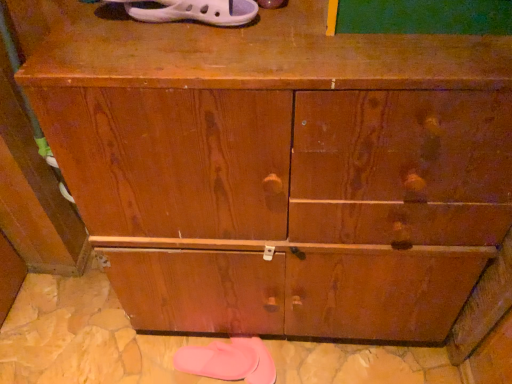
What is the approximate height of pink rubber slipper at lower center, acting as the 2th footwear starting from the front?

pink rubber slipper at lower center, acting as the 2th footwear starting from the front, is 3.07 inches in height.

At what (x,y) coordinates should I click in order to perform the action: click on pink rubber slipper at lower center, acting as the 2th footwear starting from the front. Please return your answer as a coordinate pair (x, y). Looking at the image, I should click on [229, 361].

From the picture: Measure the distance between point (x=208, y=364) and camera.

Point (x=208, y=364) and camera are 1.22 meters apart.

Describe the element at coordinates (229, 361) in the screenshot. I see `pink rubber slipper at lower center, acting as the 2th footwear starting from the front` at that location.

The height and width of the screenshot is (384, 512). What are the coordinates of `white rubber sandal at upper center, arranged as the 1th footwear when viewed from the top` in the screenshot? It's located at (197, 11).

Consider the image. In order to face white rubber sandal at upper center, the 2th footwear in the bottom-to-top sequence, should I rotate leftwards or rightwards?

To face it directly, rotate left by 8.524 degrees.

What do you see at coordinates (197, 11) in the screenshot? Image resolution: width=512 pixels, height=384 pixels. I see `white rubber sandal at upper center, the 2th footwear in the bottom-to-top sequence` at bounding box center [197, 11].

The image size is (512, 384). I want to click on pink rubber slipper at lower center, positioned as the 1th footwear in back-to-front order, so click(229, 361).

Which object is positioned more to the left, pink rubber slipper at lower center, acting as the 2th footwear starting from the front, or white rubber sandal at upper center, arranged as the 1th footwear when viewed from the top?

pink rubber slipper at lower center, acting as the 2th footwear starting from the front, is more to the left.

Is pink rubber slipper at lower center, which is counted as the second footwear, starting from the top, in front of or behind white rubber sandal at upper center, arranged as the 1th footwear when viewed from the top, in the image?

Visually, pink rubber slipper at lower center, which is counted as the second footwear, starting from the top, is located behind white rubber sandal at upper center, arranged as the 1th footwear when viewed from the top.

Between point (249, 352) and point (187, 0), which one is positioned in front?

The point (187, 0) is more forward.

From the image's perspective, which is below, pink rubber slipper at lower center, positioned as the 1th footwear in back-to-front order, or white rubber sandal at upper center, arranged as the 1th footwear when viewed from the top?

pink rubber slipper at lower center, positioned as the 1th footwear in back-to-front order, appears lower in the image.

From a real-world perspective, which object stands above the other?

In real-world perspective, white rubber sandal at upper center, placed as the second footwear when sorted from back to front, is above.

Which object is thinner, pink rubber slipper at lower center, the first footwear from the bottom, or white rubber sandal at upper center, placed as the second footwear when sorted from back to front?

pink rubber slipper at lower center, the first footwear from the bottom.

Which of these two, pink rubber slipper at lower center, acting as the 2th footwear starting from the front, or white rubber sandal at upper center, the 2th footwear in the bottom-to-top sequence, stands taller?

pink rubber slipper at lower center, acting as the 2th footwear starting from the front, is taller.

Which of these two, pink rubber slipper at lower center, the first footwear from the bottom, or white rubber sandal at upper center, placed as the second footwear when sorted from back to front, is bigger?

With larger size is white rubber sandal at upper center, placed as the second footwear when sorted from back to front.

Would you say pink rubber slipper at lower center, which is counted as the second footwear, starting from the top, contains white rubber sandal at upper center, arranged as the 1th footwear when viewed from the top?

No, white rubber sandal at upper center, arranged as the 1th footwear when viewed from the top, is located outside of pink rubber slipper at lower center, which is counted as the second footwear, starting from the top.

Consider the image. Are pink rubber slipper at lower center, the first footwear from the bottom, and white rubber sandal at upper center, placed as the second footwear when sorted from back to front, far apart?

No, pink rubber slipper at lower center, the first footwear from the bottom, is in close proximity to white rubber sandal at upper center, placed as the second footwear when sorted from back to front.

Is pink rubber slipper at lower center, the first footwear from the bottom, oriented away from white rubber sandal at upper center, arranged as the 1th footwear when viewed from the top?

No, white rubber sandal at upper center, arranged as the 1th footwear when viewed from the top, is not at the back of pink rubber slipper at lower center, the first footwear from the bottom.

How many degrees apart are the facing directions of pink rubber slipper at lower center, the first footwear from the bottom, and white rubber sandal at upper center, positioned as the first footwear in front-to-back order?

There is a 0.948-degree angle between the facing directions of pink rubber slipper at lower center, the first footwear from the bottom, and white rubber sandal at upper center, positioned as the first footwear in front-to-back order.

How distant is pink rubber slipper at lower center, the first footwear from the bottom, from white rubber sandal at upper center, arranged as the 1th footwear when viewed from the top?

pink rubber slipper at lower center, the first footwear from the bottom, is 35.32 inches from white rubber sandal at upper center, arranged as the 1th footwear when viewed from the top.

Find the location of `footwear below the white rubber sandal at upper center, the 2th footwear in the bottom-to-top sequence (from the image's perspective)`. footwear below the white rubber sandal at upper center, the 2th footwear in the bottom-to-top sequence (from the image's perspective) is located at coordinates (229, 361).

Which object is positioned more to the left, white rubber sandal at upper center, the 2th footwear in the bottom-to-top sequence, or pink rubber slipper at lower center, acting as the 2th footwear starting from the front?

pink rubber slipper at lower center, acting as the 2th footwear starting from the front.

Which object is closer to the camera taking this photo, white rubber sandal at upper center, placed as the second footwear when sorted from back to front, or pink rubber slipper at lower center, the first footwear from the bottom?

white rubber sandal at upper center, placed as the second footwear when sorted from back to front.

Is point (136, 13) positioned in front of point (269, 373)?

Yes, it is in front of point (269, 373).

From the image's perspective, is white rubber sandal at upper center, placed as the second footwear when sorted from back to front, above or below pink rubber slipper at lower center, acting as the 2th footwear starting from the front?

Clearly, from the image's perspective, white rubber sandal at upper center, placed as the second footwear when sorted from back to front, is above pink rubber slipper at lower center, acting as the 2th footwear starting from the front.

From a real-world perspective, is white rubber sandal at upper center, arranged as the 1th footwear when viewed from the top, on top of pink rubber slipper at lower center, acting as the 2th footwear starting from the front?

Yes.

Considering the sizes of objects white rubber sandal at upper center, placed as the second footwear when sorted from back to front, and pink rubber slipper at lower center, positioned as the 1th footwear in back-to-front order, in the image provided, who is wider, white rubber sandal at upper center, placed as the second footwear when sorted from back to front, or pink rubber slipper at lower center, positioned as the 1th footwear in back-to-front order,?

Wider between the two is white rubber sandal at upper center, placed as the second footwear when sorted from back to front.

Does white rubber sandal at upper center, the 2th footwear in the bottom-to-top sequence, have a lesser height compared to pink rubber slipper at lower center, the first footwear from the bottom?

Indeed, white rubber sandal at upper center, the 2th footwear in the bottom-to-top sequence, has a lesser height compared to pink rubber slipper at lower center, the first footwear from the bottom.

Considering the relative sizes of white rubber sandal at upper center, the 2th footwear in the bottom-to-top sequence, and pink rubber slipper at lower center, which is counted as the second footwear, starting from the top, in the image provided, is white rubber sandal at upper center, the 2th footwear in the bottom-to-top sequence, bigger than pink rubber slipper at lower center, which is counted as the second footwear, starting from the top,?

Yes, white rubber sandal at upper center, the 2th footwear in the bottom-to-top sequence, is bigger than pink rubber slipper at lower center, which is counted as the second footwear, starting from the top.

Is white rubber sandal at upper center, the 2th footwear in the bottom-to-top sequence, spatially inside pink rubber slipper at lower center, which is counted as the second footwear, starting from the top, or outside of it?

white rubber sandal at upper center, the 2th footwear in the bottom-to-top sequence, is spatially situated outside pink rubber slipper at lower center, which is counted as the second footwear, starting from the top.

Is white rubber sandal at upper center, arranged as the 1th footwear when viewed from the top, not near pink rubber slipper at lower center, the first footwear from the bottom?

No, white rubber sandal at upper center, arranged as the 1th footwear when viewed from the top, is not far from pink rubber slipper at lower center, the first footwear from the bottom.

Is white rubber sandal at upper center, arranged as the 1th footwear when viewed from the top, oriented away from pink rubber slipper at lower center, positioned as the 1th footwear in back-to-front order?

No, pink rubber slipper at lower center, positioned as the 1th footwear in back-to-front order, is not at the back of white rubber sandal at upper center, arranged as the 1th footwear when viewed from the top.

How different are the orientations of white rubber sandal at upper center, the 2th footwear in the bottom-to-top sequence, and pink rubber slipper at lower center, the first footwear from the bottom, in degrees?

0.948 degrees separate the facing orientations of white rubber sandal at upper center, the 2th footwear in the bottom-to-top sequence, and pink rubber slipper at lower center, the first footwear from the bottom.

Locate an element on the screen. The image size is (512, 384). footwear in front of the pink rubber slipper at lower center, the first footwear from the bottom is located at coordinates (197, 11).

At what (x,y) coordinates should I click in order to perform the action: click on footwear in front of the pink rubber slipper at lower center, the first footwear from the bottom. Please return your answer as a coordinate pair (x, y). The width and height of the screenshot is (512, 384). Looking at the image, I should click on (197, 11).

Find the location of a particular element. footwear below the white rubber sandal at upper center, the 2th footwear in the bottom-to-top sequence (from the image's perspective) is located at coordinates (229, 361).